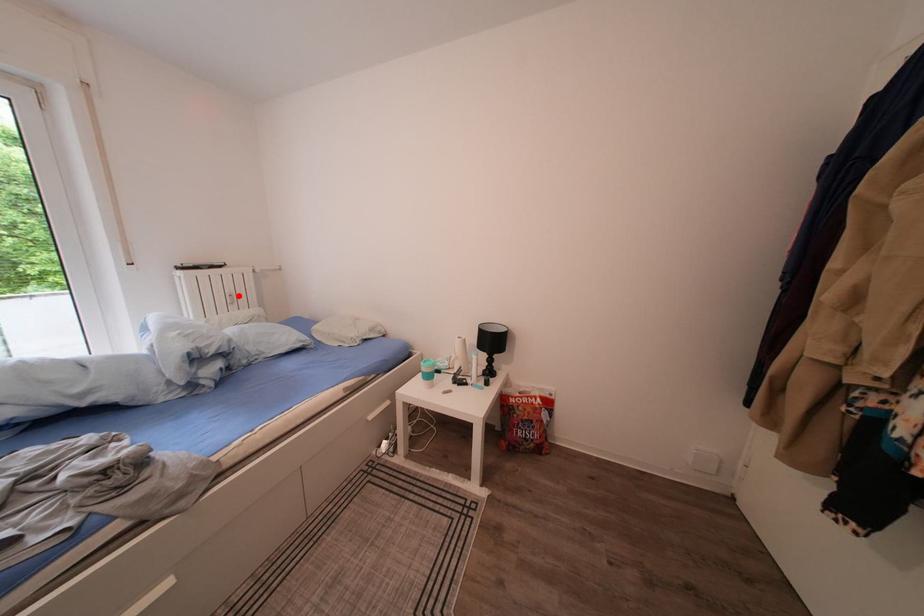
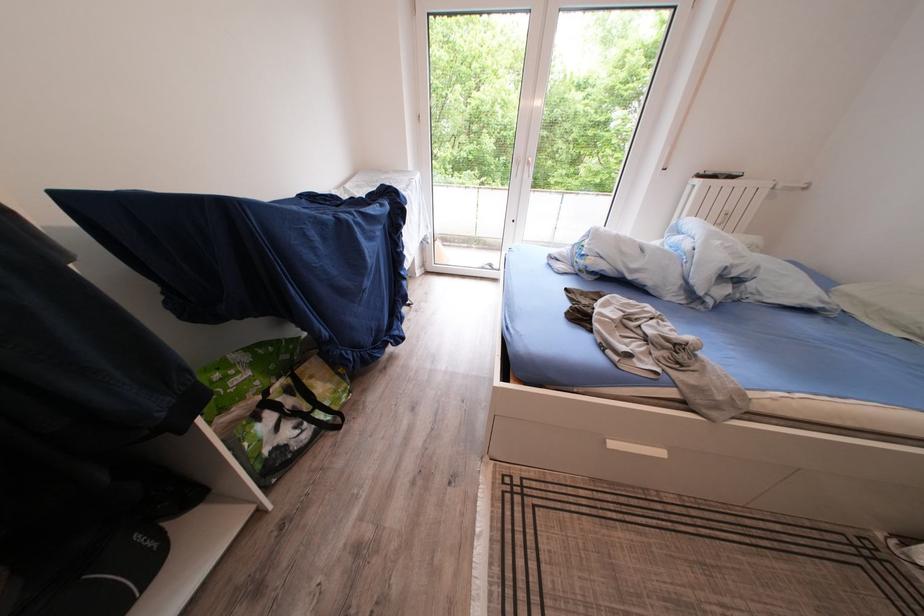
Find the pixel in the second image that matches the highlighted location in the first image.

(737, 213)